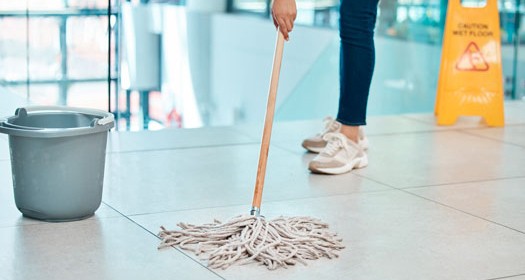
Identify the location of window panes. This screenshot has width=525, height=280. (73, 59), (33, 59), (10, 72), (46, 94), (84, 94), (81, 3), (51, 4), (16, 3).